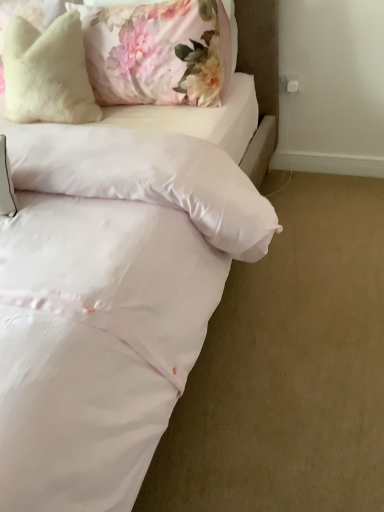
Question: From the image's perspective, is white satin bed at center on top of fluffy white pillow at upper left, placed as the 2th pillow when sorted from right to left?

Choices:
 (A) yes
 (B) no

Answer: (B)

Question: Can you confirm if white satin bed at center is positioned to the right of fluffy white pillow at upper left, placed as the 2th pillow when sorted from right to left?

Choices:
 (A) no
 (B) yes

Answer: (A)

Question: Is white satin bed at center not near fluffy white pillow at upper left, placed as the 2th pillow when sorted from right to left?

Choices:
 (A) yes
 (B) no

Answer: (B)

Question: Considering the relative sizes of white satin bed at center and fluffy white pillow at upper left, placed as the 2th pillow when sorted from right to left, in the image provided, is white satin bed at center taller than fluffy white pillow at upper left, placed as the 2th pillow when sorted from right to left,?

Choices:
 (A) yes
 (B) no

Answer: (A)

Question: Does white satin bed at center have a lesser width compared to fluffy white pillow at upper left, placed as the 2th pillow when sorted from right to left?

Choices:
 (A) yes
 (B) no

Answer: (B)

Question: Does white satin bed at center lie behind fluffy white pillow at upper left, placed as the 2th pillow when sorted from right to left?

Choices:
 (A) no
 (B) yes

Answer: (A)

Question: Considering the relative sizes of fluffy white pillow at upper left, placed as the 2th pillow when sorted from right to left, and fluffy white pillow at upper left, marked as the second pillow in a left-to-right arrangement, in the image provided, is fluffy white pillow at upper left, placed as the 2th pillow when sorted from right to left, shorter than fluffy white pillow at upper left, marked as the second pillow in a left-to-right arrangement,?

Choices:
 (A) no
 (B) yes

Answer: (A)

Question: From the image's perspective, is fluffy white pillow at upper left, arranged as the 1th pillow when viewed from the left, below fluffy white pillow at upper left, marked as the second pillow in a left-to-right arrangement?

Choices:
 (A) yes
 (B) no

Answer: (A)

Question: Would you say fluffy white pillow at upper left, arranged as the 1th pillow when viewed from the left, is outside fluffy white pillow at upper left, marked as the second pillow in a left-to-right arrangement?

Choices:
 (A) no
 (B) yes

Answer: (B)

Question: Is fluffy white pillow at upper left, arranged as the 1th pillow when viewed from the left, wider than fluffy white pillow at upper left, the 1th pillow positioned from the right?

Choices:
 (A) yes
 (B) no

Answer: (A)

Question: Does fluffy white pillow at upper left, arranged as the 1th pillow when viewed from the left, have a larger size compared to fluffy white pillow at upper left, the 1th pillow positioned from the right?

Choices:
 (A) no
 (B) yes

Answer: (A)

Question: Is fluffy white pillow at upper left, arranged as the 1th pillow when viewed from the left, looking in the opposite direction of fluffy white pillow at upper left, marked as the second pillow in a left-to-right arrangement?

Choices:
 (A) no
 (B) yes

Answer: (B)

Question: Is fluffy white pillow at upper left, marked as the second pillow in a left-to-right arrangement, to the right of white satin bed at center from the viewer's perspective?

Choices:
 (A) no
 (B) yes

Answer: (B)